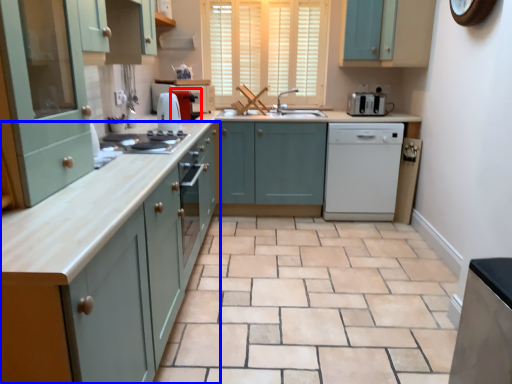
Question: Which object is closer to the camera taking this photo, coffee machine (highlighted by a red box) or cabinetry (highlighted by a blue box)?

Choices:
 (A) coffee machine
 (B) cabinetry

Answer: (B)